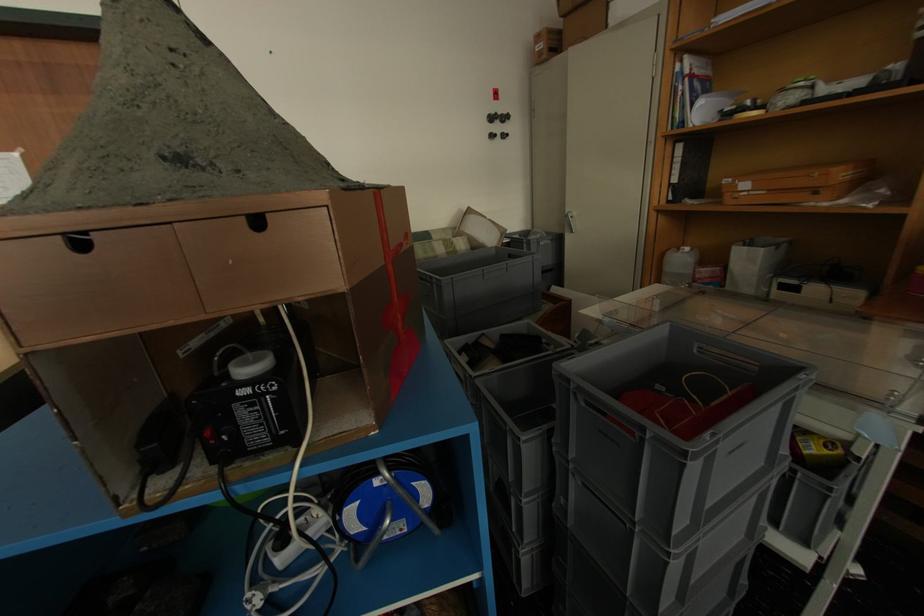
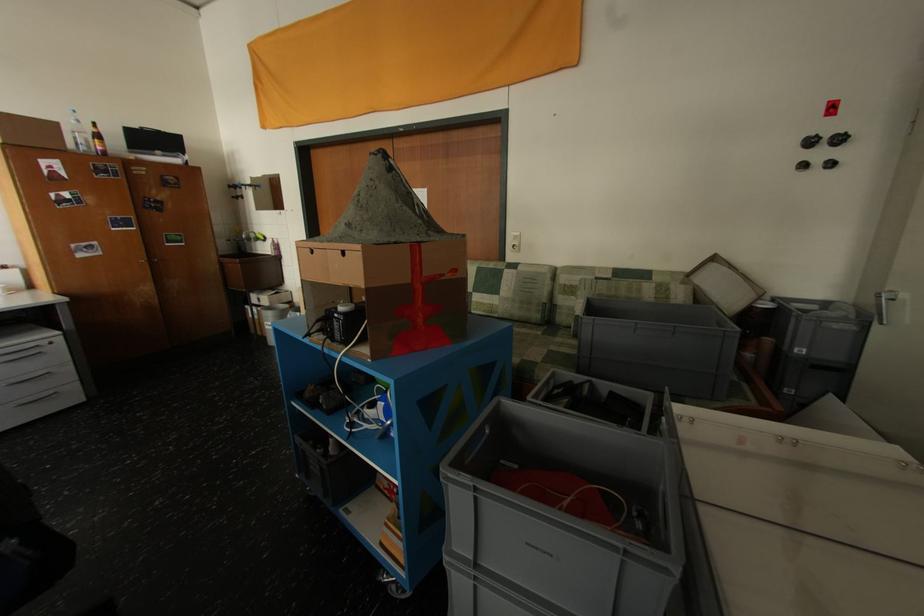
The point at (497, 140) is marked in the first image. Where is the corresponding point in the second image?

(806, 169)